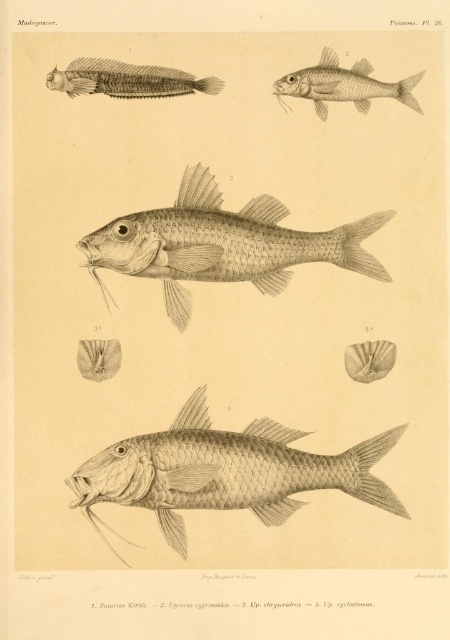
Who is taller, gray textured fish at center or grayish-silver fish at upper left?

Standing taller between the two is gray textured fish at center.

Which is in front, point (288, 436) or point (211, 88)?

Point (288, 436) is more forward.

Who is more forward, (86, 470) or (125, 84)?

Positioned in front is point (86, 470).

The width and height of the screenshot is (450, 640). Find the location of `gray textured fish at center`. gray textured fish at center is located at coordinates (225, 472).

Between point (266, 440) and point (364, 96), which one is positioned behind?

Point (364, 96)

Which is below, gray textured fish at center or grayish silver fish at upper center?

gray textured fish at center is below.

Where is `gray textured fish at center`? The width and height of the screenshot is (450, 640). gray textured fish at center is located at coordinates (225, 472).

Is grayish-silver fish at upper left to the right of grayish silver fish at upper center from the viewer's perspective?

No, grayish-silver fish at upper left is not to the right of grayish silver fish at upper center.

In the scene shown: Which of these two, grayish-silver fish at upper left or grayish silver fish at upper center, stands taller?

With more height is grayish silver fish at upper center.

I want to click on grayish-silver fish at upper left, so click(x=126, y=80).